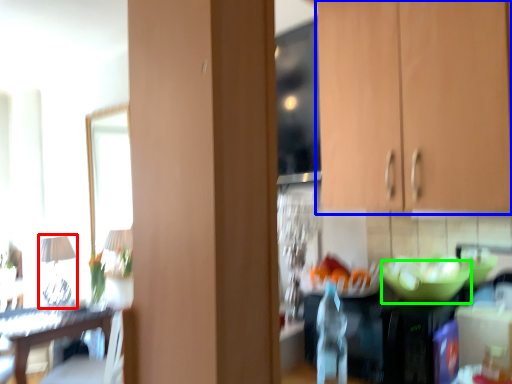
Question: Which object is the closest to the lamp (highlighted by a red box)? Choose among these: cabinetry (highlighted by a blue box) or glass bowl (highlighted by a green box).

Choices:
 (A) cabinetry
 (B) glass bowl

Answer: (B)